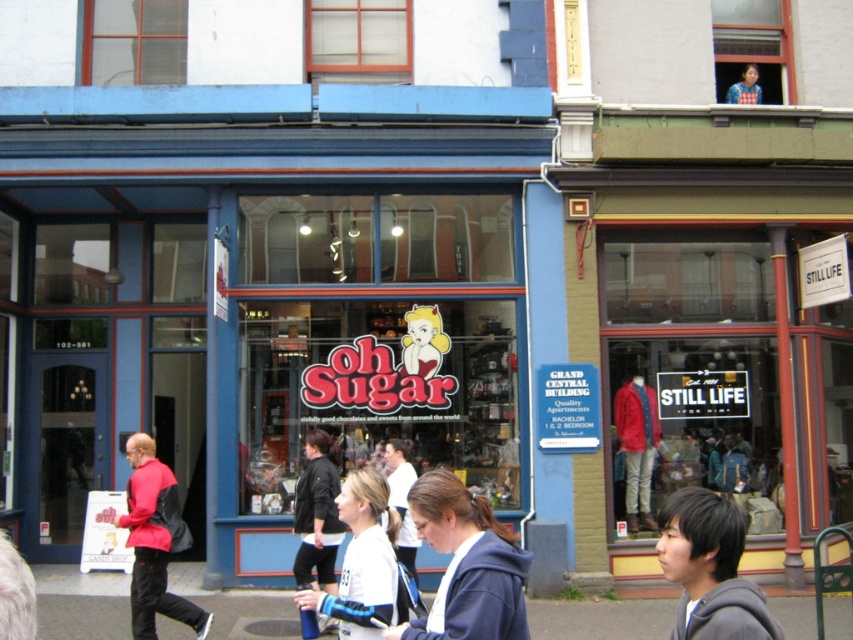
You are a customer looking at the mannequin in the window of the Still Life store. You see a gray fleece jacket at lower right and a blue fabric shirt at upper right. Which piece of clothing is closer to the left side of the mannequin?

The gray fleece jacket at lower right is positioned on the left side of blue fabric shirt at upper right, so it is closer to the left side of the mannequin.